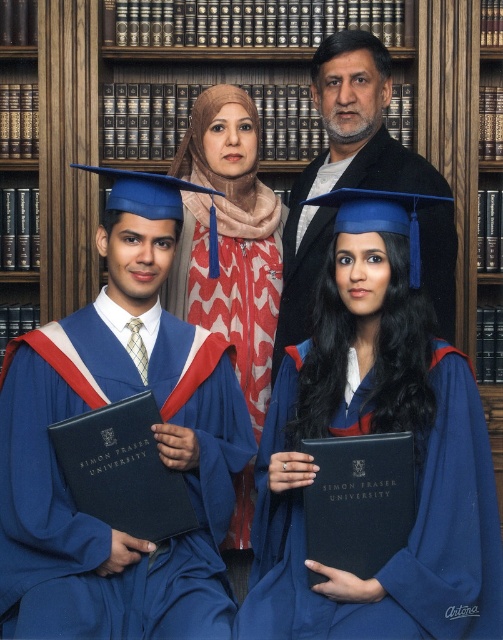
Does matte blue gown at center appear under matte blue hijab at center?

Correct, matte blue gown at center is located below matte blue hijab at center.

Does point (132, 573) come closer to viewer compared to point (263, 275)?

Yes, point (132, 573) is in front of point (263, 275).

Where is `matte blue gown at center`? matte blue gown at center is located at coordinates (108, 525).

Is blue matte graduation gown at center to the left of matte black jacket at center from the viewer's perspective?

Indeed, blue matte graduation gown at center is positioned on the left side of matte black jacket at center.

Is point (496, 614) positioned after point (384, 132)?

No, it is not.

Is point (292, 381) in front of point (344, 33)?

Yes.

Image resolution: width=503 pixels, height=640 pixels. Find the location of `blue matte graduation gown at center`. blue matte graduation gown at center is located at coordinates (375, 433).

Is matte blue hijab at center in front of matte black jacket at center?

Yes, it is in front of matte black jacket at center.

Which is more to the right, matte blue hijab at center or matte black jacket at center?

matte black jacket at center is more to the right.

Where is `matte blue hijab at center`? This screenshot has height=640, width=503. matte blue hijab at center is located at coordinates (229, 240).